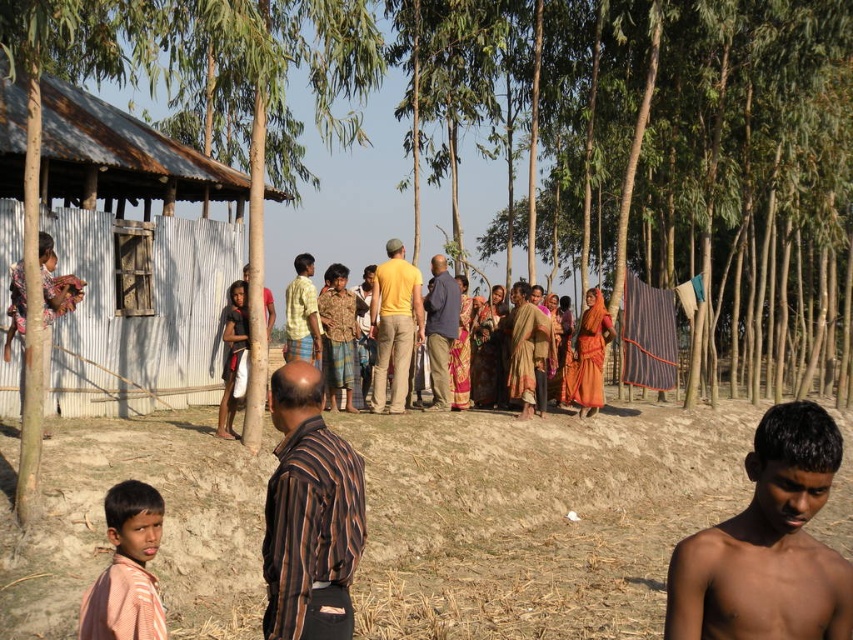
Imagine you are standing in the village scene described. You notice two points marked in the image, one at coordinates point (747, 52) and another at point (383, 317). Which of these points is closer to your current position?

Point (747, 52) is further to the viewer than point (383, 317), so the point at (383, 317) is closer to your current position.

In the rural village scene, there are two items of interest. One is a shiny brown skin at lower right and the other is a brown striped shirt at center. From the perspective of someone standing at the center of the scene, which object is positioned to the right?

The shiny brown skin at lower right is positioned to the right of the brown striped shirt at center.